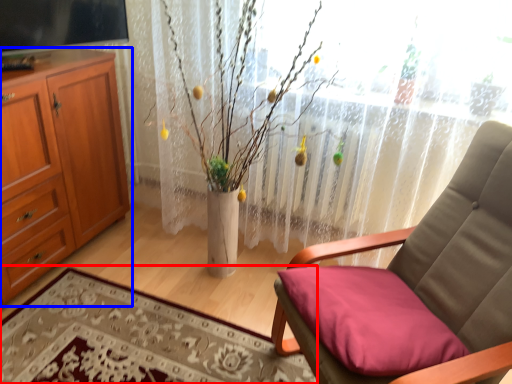
Question: Which of the following is the farthest to the observer, plain (highlighted by a red box) or cabinetry (highlighted by a blue box)?

Choices:
 (A) plain
 (B) cabinetry

Answer: (B)